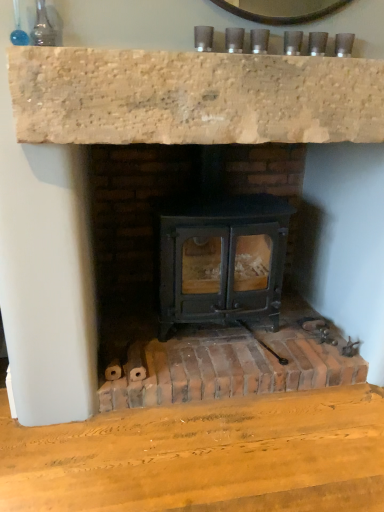
Question: Should I look upward or downward to see brick hearth at center?

Choices:
 (A) down
 (B) up

Answer: (A)